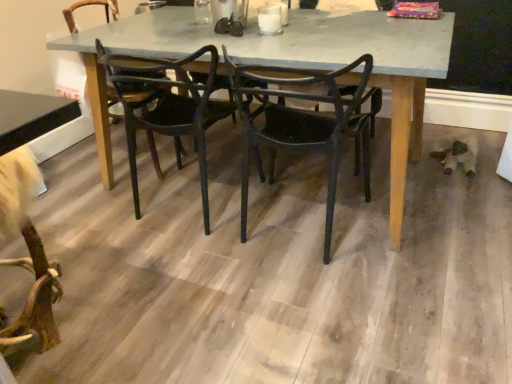
Where is `vacant area that is in front of black plastic chair at center, which ranks as the first chair in left-to-right order`? Image resolution: width=512 pixels, height=384 pixels. vacant area that is in front of black plastic chair at center, which ranks as the first chair in left-to-right order is located at coordinates click(x=191, y=284).